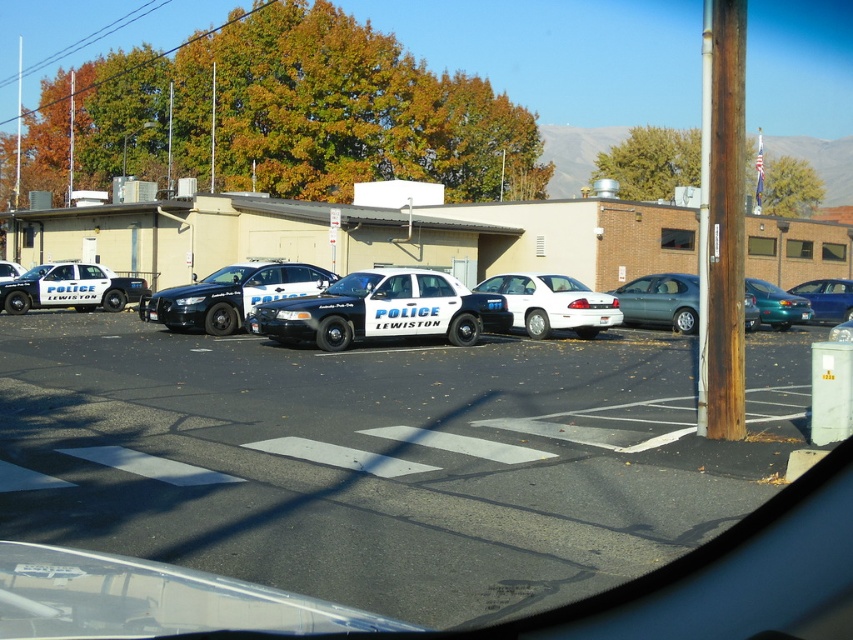
You are a delivery driver who needs to park your truck in the parking lot. You see the metallic blue police car at center and the metallic teal sedan at right. Which vehicle should you avoid parking too close to, and why?

You should avoid parking too close to the metallic blue police car at center because it is positioned over the metallic teal sedan at right, indicating it might be blocking access to that area or occupying a space that overlaps with the sedan.

You are a delivery driver who needs to park your 1.8 meters tall delivery van in this parking lot. You see a metallic blue police car at center and a teal metallic sedan at right. Which vehicle is shorter, and can your van fit between them if there is a 2.2 meters gap?

The metallic blue police car at center is shorter than the teal metallic sedan at right. The gap between them is 2.2 meters, which is wider than your van height of 1.8 meters, so your van can fit between them.